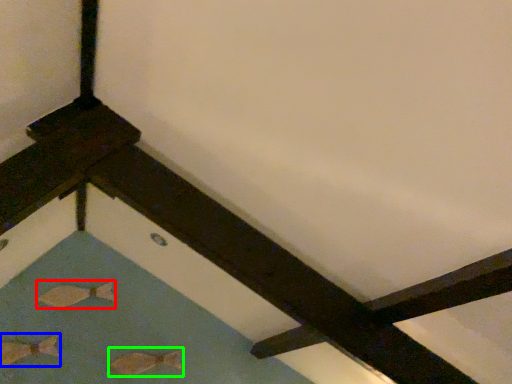
Question: Estimate the real-world distances between objects in this image. Which object is farther from fish (highlighted by a red box), fish (highlighted by a blue box) or fish (highlighted by a green box)?

Choices:
 (A) fish
 (B) fish

Answer: (B)